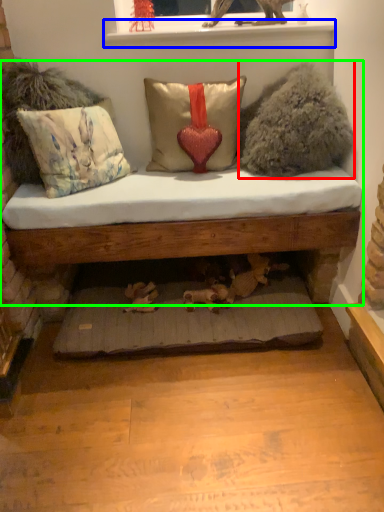
Question: Estimate the real-world distances between objects in this image. Which object is closer to animal (highlighted by a red box), window sill (highlighted by a blue box) or studio couch (highlighted by a green box)?

Choices:
 (A) window sill
 (B) studio couch

Answer: (A)